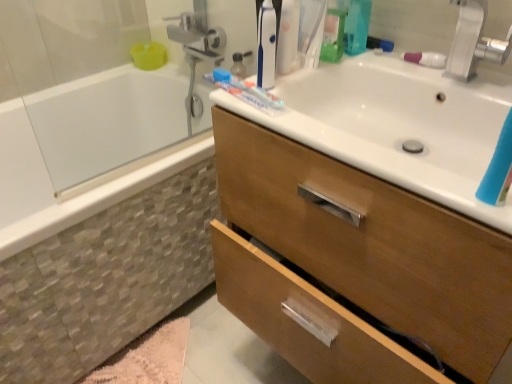
Question: Does wooden cabinet at upper right have a greater height compared to white glossy bathtub at left?

Choices:
 (A) no
 (B) yes

Answer: (B)

Question: From a real-world perspective, is wooden cabinet at upper right beneath white glossy bathtub at left?

Choices:
 (A) no
 (B) yes

Answer: (A)

Question: Is white glossy bathtub at left inside wooden cabinet at upper right?

Choices:
 (A) yes
 (B) no

Answer: (B)

Question: Is wooden cabinet at upper right facing towards white glossy bathtub at left?

Choices:
 (A) yes
 (B) no

Answer: (B)

Question: Can you confirm if wooden cabinet at upper right is shorter than white glossy bathtub at left?

Choices:
 (A) no
 (B) yes

Answer: (A)

Question: Considering their positions, is white glossy sink at upper right located in front of or behind silver metallic faucet at upper right?

Choices:
 (A) front
 (B) behind

Answer: (A)

Question: Considering the positions of white glossy sink at upper right and silver metallic faucet at upper right in the image, is white glossy sink at upper right wider or thinner than silver metallic faucet at upper right?

Choices:
 (A) wide
 (B) thin

Answer: (A)

Question: Is white glossy sink at upper right inside the boundaries of silver metallic faucet at upper right, or outside?

Choices:
 (A) inside
 (B) outside

Answer: (B)

Question: In terms of height, does white glossy sink at upper right look taller or shorter compared to silver metallic faucet at upper right?

Choices:
 (A) short
 (B) tall

Answer: (A)

Question: Is point (429, 54) closer or farther from the camera than point (114, 370)?

Choices:
 (A) closer
 (B) farther

Answer: (A)

Question: Would you say pink plastic toothbrush at upper right is inside or outside pink fluffy bath mat at lower left?

Choices:
 (A) inside
 (B) outside

Answer: (B)

Question: Based on their positions, is pink plastic toothbrush at upper right located to the left or right of pink fluffy bath mat at lower left?

Choices:
 (A) right
 (B) left

Answer: (A)

Question: In terms of width, does pink plastic toothbrush at upper right look wider or thinner when compared to pink fluffy bath mat at lower left?

Choices:
 (A) wide
 (B) thin

Answer: (B)

Question: In terms of size, does white glossy sink at upper right appear bigger or smaller than translucent plastic toothpaste at upper center?

Choices:
 (A) big
 (B) small

Answer: (A)

Question: Considering their positions, is white glossy sink at upper right located in front of or behind translucent plastic toothpaste at upper center?

Choices:
 (A) behind
 (B) front

Answer: (B)